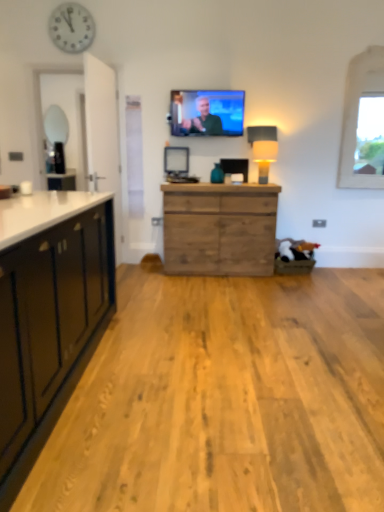
Question: From the image's perspective, relative to white plastic clock at upper left, is matte black television at upper center above or below?

Choices:
 (A) above
 (B) below

Answer: (B)

Question: From a real-world perspective, is matte black television at upper center positioned above or below white plastic clock at upper left?

Choices:
 (A) below
 (B) above

Answer: (A)

Question: Based on their relative distances, which object is nearer to the white fabric lampshade at right?

Choices:
 (A) white plastic clock at upper left
 (B) matte black television at upper center
 (C) white stone window at upper right
 (D) wooden chest of drawers at center

Answer: (B)

Question: Which is nearer to the white fabric lampshade at right?

Choices:
 (A) matte black television at upper center
 (B) wooden chest of drawers at center
 (C) white stone window at upper right
 (D) white plastic clock at upper left

Answer: (A)